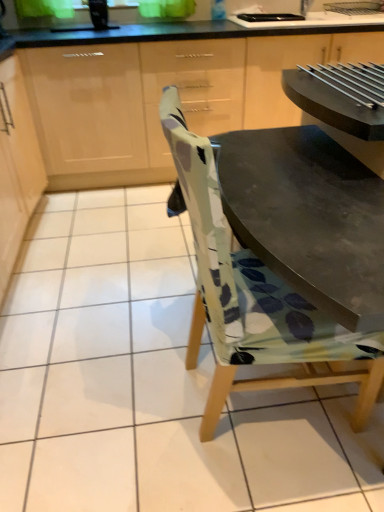
Question: Is printed fabric chair at center inside the boundaries of matte wood cabinets at upper center, placed as the 2th cabinetry when sorted from left to right, or outside?

Choices:
 (A) outside
 (B) inside

Answer: (A)

Question: Looking at their shapes, would you say printed fabric chair at center is wider or thinner than matte wood cabinets at upper center, the first cabinetry positioned from the right?

Choices:
 (A) wide
 (B) thin

Answer: (B)

Question: Estimate the real-world distances between objects in this image. Which object is farther from the matte wood cabinets at upper center, placed as the 2th cabinetry when sorted from left to right?

Choices:
 (A) printed fabric chair at center
 (B) light wood cabinet at upper left, the 1th cabinetry positioned from the left

Answer: (A)

Question: Estimate the real-world distances between objects in this image. Which object is farther from the light wood cabinet at upper left, arranged as the 2th cabinetry when viewed from the right?

Choices:
 (A) printed fabric chair at center
 (B) matte wood cabinets at upper center, the first cabinetry positioned from the right

Answer: (A)